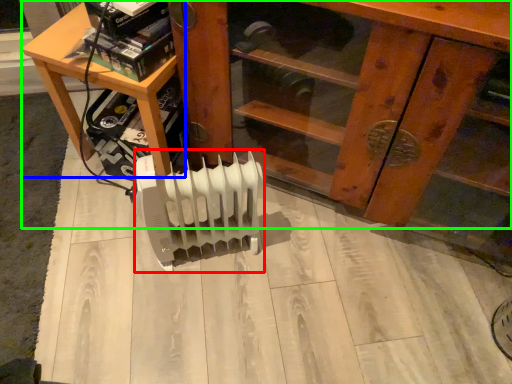
Question: Which is farther away from heater (highlighted by a red box)? table (highlighted by a blue box) or furniture (highlighted by a green box)?

Choices:
 (A) table
 (B) furniture

Answer: (B)